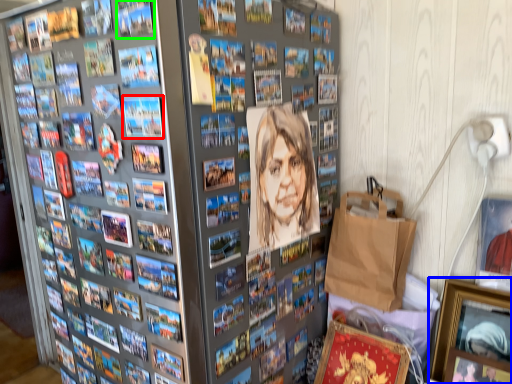
Question: Considering the real-world distances, which object is farthest from comic book (highlighted by a red box)? picture frame (highlighted by a blue box) or comic book (highlighted by a green box)?

Choices:
 (A) picture frame
 (B) comic book

Answer: (A)